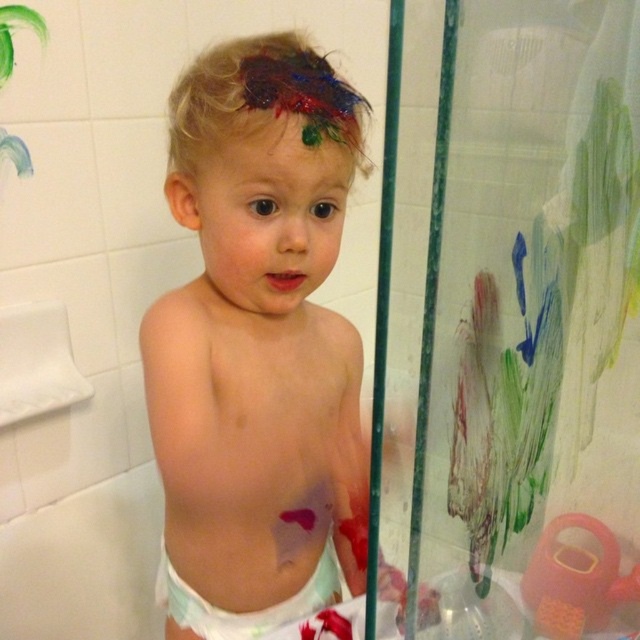
Is point (323, 88) positioned behind point (321, 563)?

No, (323, 88) is closer to viewer.

Can you confirm if multicolored paint at center is wider than white cloth diaper at lower center?

In fact, multicolored paint at center might be narrower than white cloth diaper at lower center.

Is point (268, 52) more distant than point (209, 605)?

That is False.

Where is `multicolored paint at center`? The width and height of the screenshot is (640, 640). multicolored paint at center is located at coordinates (262, 99).

Between transparent plastic screen door at upper right and dirty diaper at center, which one is positioned higher?

Positioned higher is transparent plastic screen door at upper right.

Is transparent plastic screen door at upper right bigger than dirty diaper at center?

Indeed, transparent plastic screen door at upper right has a larger size compared to dirty diaper at center.

Which is in front, point (380, 280) or point (252, 365)?

Positioned in front is point (380, 280).

Locate an element on the screen. This screenshot has width=640, height=640. transparent plastic screen door at upper right is located at coordinates (509, 317).

Is rubberized plastic bucket at lower right to the right of white cloth diaper at lower center from the viewer's perspective?

Correct, you'll find rubberized plastic bucket at lower right to the right of white cloth diaper at lower center.

The height and width of the screenshot is (640, 640). I want to click on rubberized plastic bucket at lower right, so click(x=576, y=579).

Locate an element on the screen. This screenshot has width=640, height=640. rubberized plastic bucket at lower right is located at coordinates (576, 579).